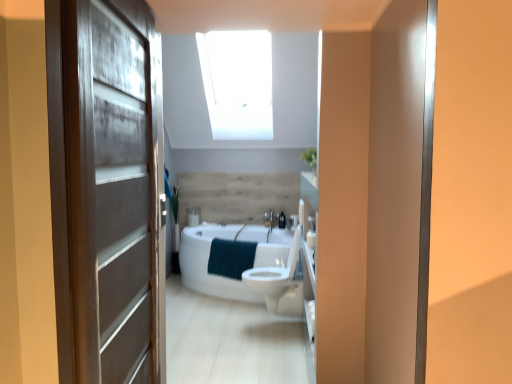
What do you see at coordinates (282, 220) in the screenshot? I see `matte black soap dispenser at center` at bounding box center [282, 220].

You are a GUI agent. You are given a task and a screenshot of the screen. Output one action in this format:
    pyautogui.click(x=<x>, y=<y>)
    Task: Click on the matte black soap dispenser at center
    This screenshot has width=512, height=384.
    Given the screenshot: What is the action you would take?
    pyautogui.click(x=282, y=220)

You are a GUI agent. You are given a task and a screenshot of the screen. Output one action in this format:
    pyautogui.click(x=<x>, y=<y>)
    Task: Click on the white matte toilet paper at right
    The image size is (512, 384).
    Given the screenshot: What is the action you would take?
    pyautogui.click(x=311, y=239)

Describe the element at coordinates (231, 258) in the screenshot. I see `teal soft towel at center` at that location.

What are the coordinates of `matte black soap dispenser at center` in the screenshot? It's located at (282, 220).

Consider the image. From the image's perspective, is white matte toilet paper at right located beneath white glossy toilet at center?

Actually, white matte toilet paper at right appears above white glossy toilet at center in the image.

Considering the relative sizes of white matte toilet paper at right and white glossy toilet at center in the image provided, is white matte toilet paper at right taller than white glossy toilet at center?

No, white matte toilet paper at right is not taller than white glossy toilet at center.

In the image, is white matte toilet paper at right on the left side or the right side of white glossy toilet at center?

From the image, it's evident that white matte toilet paper at right is to the right of white glossy toilet at center.

You are a GUI agent. You are given a task and a screenshot of the screen. Output one action in this format:
    pyautogui.click(x=<x>, y=<y>)
    Task: Click on the toilet bowl that appears below the white matte toilet paper at right (from a real-world perspective)
    The image size is (512, 384).
    Given the screenshot: What is the action you would take?
    pyautogui.click(x=279, y=282)

Consider the image. Would you say white matte toilet paper at right is inside or outside teal soft towel at center?

white matte toilet paper at right exists outside the volume of teal soft towel at center.

How different are the orientations of white matte toilet paper at right and teal soft towel at center in degrees?

The angle between the facing direction of white matte toilet paper at right and the facing direction of teal soft towel at center is 65.6 degrees.

Measure the distance from white matte toilet paper at right to teal soft towel at center.

white matte toilet paper at right is 1.15 meters away from teal soft towel at center.

Between white matte toilet paper at right and teal soft towel at center, which one has more height?

teal soft towel at center is taller.

Is matte black soap dispenser at center closer to the viewer compared to white glossy toilet at center?

No.

Is white glossy toilet at center surrounded by matte black soap dispenser at center?

No, white glossy toilet at center is located outside of matte black soap dispenser at center.

Does matte black soap dispenser at center have a greater height compared to white glossy toilet at center?

No, matte black soap dispenser at center is not taller than white glossy toilet at center.

Does matte black soap dispenser at center have a lesser width compared to white glossy toilet at center?

Indeed, matte black soap dispenser at center has a lesser width compared to white glossy toilet at center.

Does point (310, 239) come farther from viewer compared to point (279, 218)?

No, (310, 239) is closer to viewer.

Between white matte toilet paper at right and matte black soap dispenser at center, which one is positioned behind?

matte black soap dispenser at center.

Considering the relative sizes of white glossy toilet at center and white glossy bathtub at center in the image provided, is white glossy toilet at center bigger than white glossy bathtub at center?

Incorrect, white glossy toilet at center is not larger than white glossy bathtub at center.

Between white glossy toilet at center and white glossy bathtub at center, which one has smaller width?

With smaller width is white glossy toilet at center.

Are white glossy toilet at center and white glossy bathtub at center located far from each other?

No, white glossy toilet at center is in close proximity to white glossy bathtub at center.

Would you say white glossy toilet at center is part of teal soft towel at center's contents?

Actually, white glossy toilet at center is outside teal soft towel at center.

Considering the relative sizes of teal soft towel at center and white glossy toilet at center in the image provided, is teal soft towel at center smaller than white glossy toilet at center?

Indeed, teal soft towel at center has a smaller size compared to white glossy toilet at center.

Can you confirm if teal soft towel at center is thinner than white glossy toilet at center?

Correct, the width of teal soft towel at center is less than that of white glossy toilet at center.

Considering the sizes of objects white glossy toilet at center and teal soft towel at center in the image provided, who is smaller, white glossy toilet at center or teal soft towel at center?

teal soft towel at center.

Which object is positioned more to the right, white glossy toilet at center or teal soft towel at center?

Positioned to the right is white glossy toilet at center.

Based on the photo, from the image's perspective, which one is positioned higher, white glossy toilet at center or teal soft towel at center?

teal soft towel at center.

What are the coordinates of `toilet bowl behind the white matte toilet paper at right` in the screenshot? It's located at 279,282.

Where is `blanket below the white matte toilet paper at right (from the image's perspective)`? blanket below the white matte toilet paper at right (from the image's perspective) is located at coordinates (231, 258).

Considering their positions, is white glossy toilet at center positioned closer to matte black soap dispenser at center than white glossy bathtub at center?

white glossy bathtub at center is closer to matte black soap dispenser at center.

Looking at the image, which one is located further to white glossy bathtub at center, teal soft towel at center or matte black soap dispenser at center?

Based on the image, matte black soap dispenser at center appears to be further to white glossy bathtub at center.

Based on their spatial positions, is white glossy bathtub at center or matte black soap dispenser at center closer to teal soft towel at center?

white glossy bathtub at center is closer to teal soft towel at center.

Considering their positions, is matte black soap dispenser at center positioned closer to white matte toilet paper at right than white glossy bathtub at center?

Among the two, white glossy bathtub at center is located nearer to white matte toilet paper at right.

Which object lies nearer to the anchor point matte brown door at left, white glossy toilet at center or white matte toilet paper at right?

white matte toilet paper at right.

From the image, which object appears to be farther from white matte toilet paper at right, white glossy toilet at center or teal soft towel at center?

teal soft towel at center lies further to white matte toilet paper at right than the other object.

Looking at the image, which one is located further to white glossy bathtub at center, white matte toilet paper at right or teal soft towel at center?

The object further to white glossy bathtub at center is white matte toilet paper at right.

When comparing their distances from white matte toilet paper at right, does teal soft towel at center or white glossy bathtub at center seem further?

Among the two, white glossy bathtub at center is located further to white matte toilet paper at right.

Image resolution: width=512 pixels, height=384 pixels. Find the location of `blanket located between white glossy bathtub at center and matte black soap dispenser at center in the depth direction`. blanket located between white glossy bathtub at center and matte black soap dispenser at center in the depth direction is located at coordinates (231, 258).

Locate an element on the screen. The image size is (512, 384). toilet bowl between white matte toilet paper at right and teal soft towel at center from front to back is located at coordinates (279, 282).

Find the location of `bathtub between white matte toilet paper at right and matte black soap dispenser at center in the front-back direction`. bathtub between white matte toilet paper at right and matte black soap dispenser at center in the front-back direction is located at coordinates (230, 257).

Where is `toilet bowl between white matte toilet paper at right and matte black soap dispenser at center from front to back`? toilet bowl between white matte toilet paper at right and matte black soap dispenser at center from front to back is located at coordinates (279, 282).